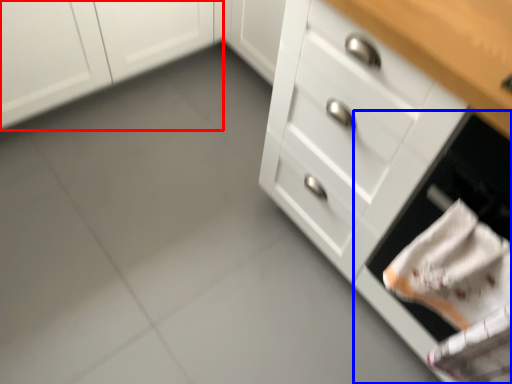
Question: Which object is further to the camera taking this photo, cabinetry (highlighted by a red box) or oven (highlighted by a blue box)?

Choices:
 (A) cabinetry
 (B) oven

Answer: (A)